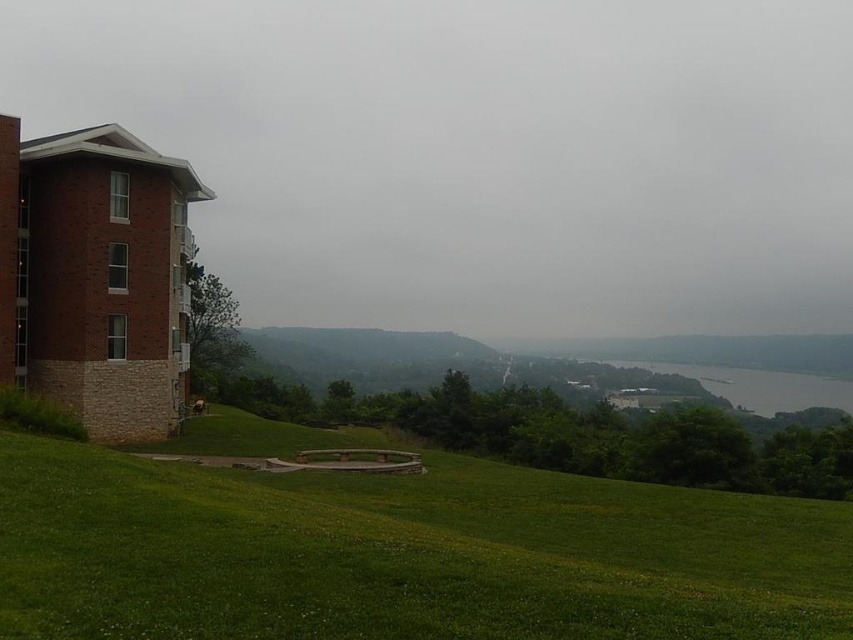
Question: Can you confirm if green grassy at lower center is bigger than gray water at lower right?

Choices:
 (A) yes
 (B) no

Answer: (B)

Question: Does green grassy at lower center appear over gray water at lower right?

Choices:
 (A) no
 (B) yes

Answer: (B)

Question: Which point is closer to the camera taking this photo?

Choices:
 (A) (712, 374)
 (B) (643, 541)

Answer: (B)

Question: Can you confirm if green grassy at lower center is bigger than gray water at lower right?

Choices:
 (A) yes
 (B) no

Answer: (B)

Question: Which of the following is the closest to the observer?

Choices:
 (A) (561, 522)
 (B) (775, 410)

Answer: (A)

Question: Which of the following is the farthest from the observer?

Choices:
 (A) (820, 388)
 (B) (648, 524)

Answer: (A)